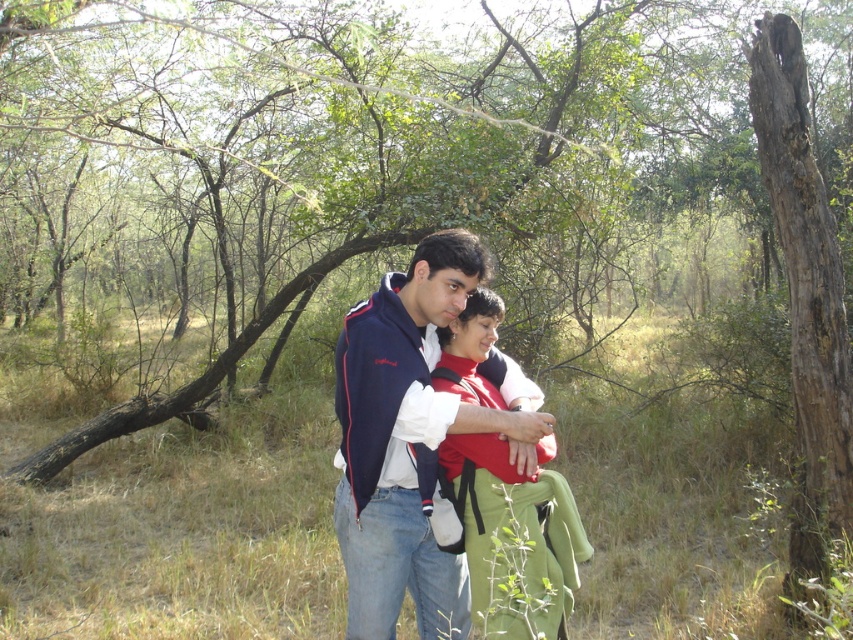
You are a hiker trying to navigate through the forest. You see two markers at the coordinates point (x=469, y=429) and point (x=471, y=525). Which marker is closer to you?

Point (x=469, y=429) is in front of point (x=471, y=525), so it is closer to you.